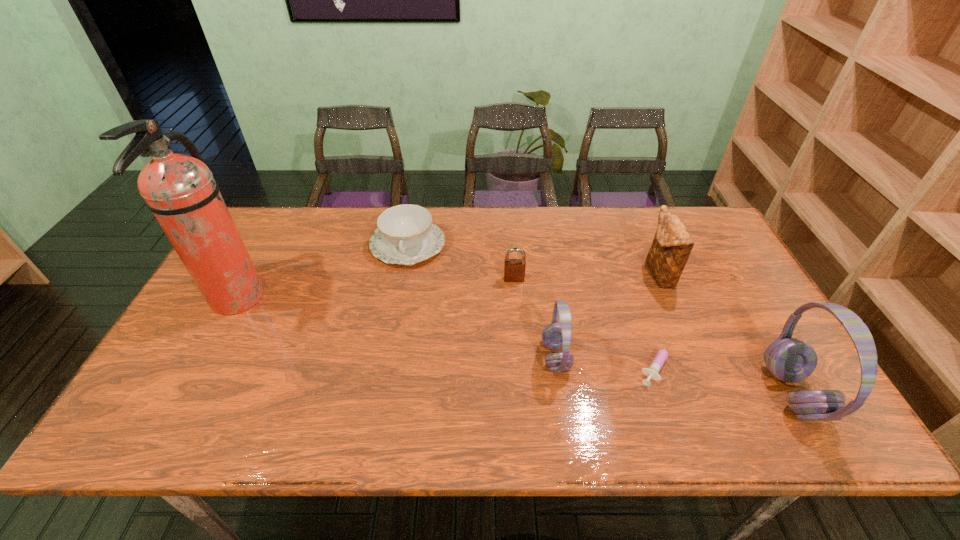
Locate an element on the screen. the tallest object is located at coordinates (180, 190).

At what (x,y) coordinates should I click in order to perform the action: click on syringe. Please return your answer as a coordinate pair (x, y). Looking at the image, I should click on (652, 371).

You are a GUI agent. You are given a task and a screenshot of the screen. Output one action in this format:
    pyautogui.click(x=<x>, y=<y>)
    Task: Click on the blank space located on the headband and ear cups of the left headset
    
    Given the screenshot: What is the action you would take?
    pyautogui.click(x=469, y=357)

The height and width of the screenshot is (540, 960). Identify the location of free space located on the headband and ear cups of the left headset. (438, 357).

Where is `vacant area situated on the headband and ear cups of the left headset`? This screenshot has width=960, height=540. vacant area situated on the headband and ear cups of the left headset is located at coordinates (405, 357).

You are a GUI agent. You are given a task and a screenshot of the screen. Output one action in this format:
    pyautogui.click(x=<x>, y=<y>)
    Task: Click on the vacant space situated on the open side of the clutch bag
    The height and width of the screenshot is (540, 960).
    Given the screenshot: What is the action you would take?
    pyautogui.click(x=555, y=274)

At what (x,y) coordinates should I click in order to perform the action: click on free spot located on the open side of the clutch bag. Please return your answer as a coordinate pair (x, y). Looking at the image, I should click on pos(568,274).

The height and width of the screenshot is (540, 960). Identify the location of blank space located 0.290m on the open side of the clutch bag. (548, 274).

At what (x,y) coordinates should I click in order to perform the action: click on free location located 0.280m on the handle side of the second shortest object. Please return your answer as a coordinate pair (x, y). The width and height of the screenshot is (960, 540). Looking at the image, I should click on (390, 344).

Locate an element on the screen. The height and width of the screenshot is (540, 960). blank space located on the front-facing side of the padlock is located at coordinates (519, 349).